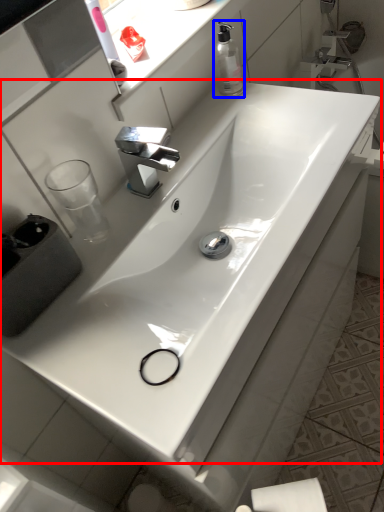
Question: Among these objects, which one is nearest to the camera, sink (highlighted by a red box) or soap dispenser (highlighted by a blue box)?

Choices:
 (A) sink
 (B) soap dispenser

Answer: (A)